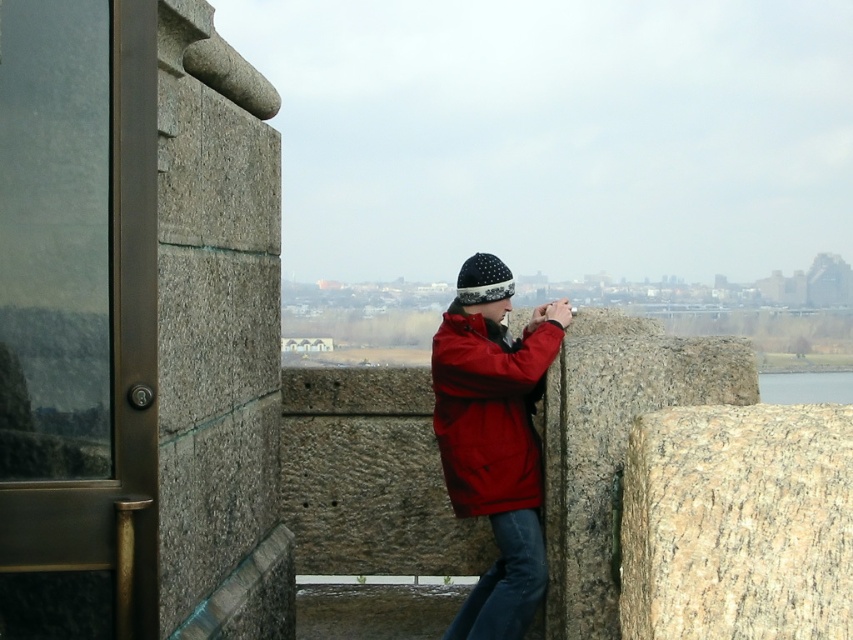
You are a fashion designer observing a person dressed in a matte red jacket at center and denim at center. Which piece of clothing is longer in height?

The matte red jacket at center is taller than denim at center, so the matte red jacket at center is longer in height.

You are a tailor measuring the distance between the matte red jacket at center and the denim at center for a custom fitting. Can you fit a 12 inch wide accessory between them?

The distance between the matte red jacket at center and the denim at center is 19.41 inches, so yes, a 12 inch wide accessory can fit between them since there is enough space.

You are a photographer standing at point (x=543, y=548) and want to take a photo of the cityscape. There is another point at (x=520, y=355) where you could position yourself. Considering the spatial relationship between these two points, which position would allow you to capture a wider view of the cityscape?

Point (x=520, y=355) is behind point (x=543, y=548). Since you want a wider view, you should choose the position at point (x=543, y=548) because being closer to the foreground allows for a broader perspective.